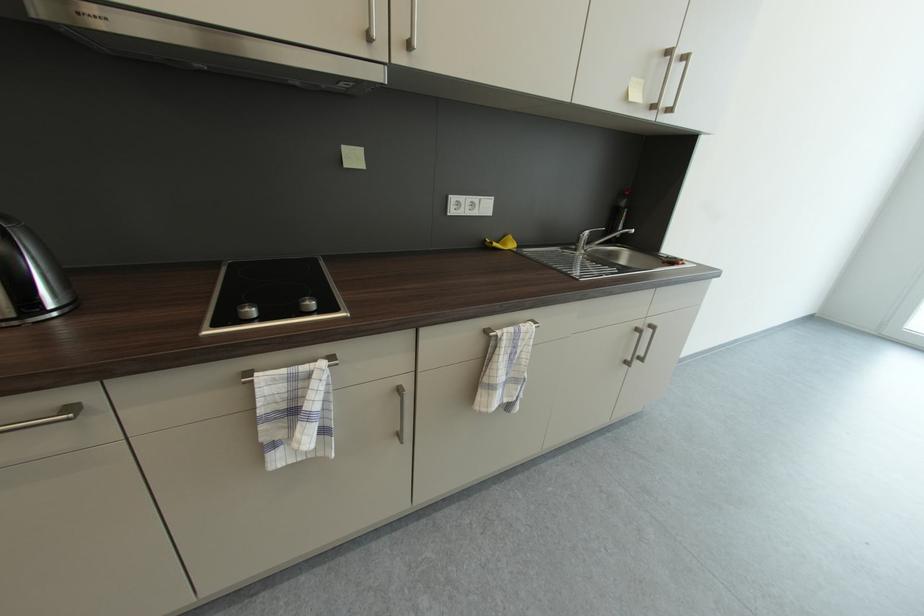
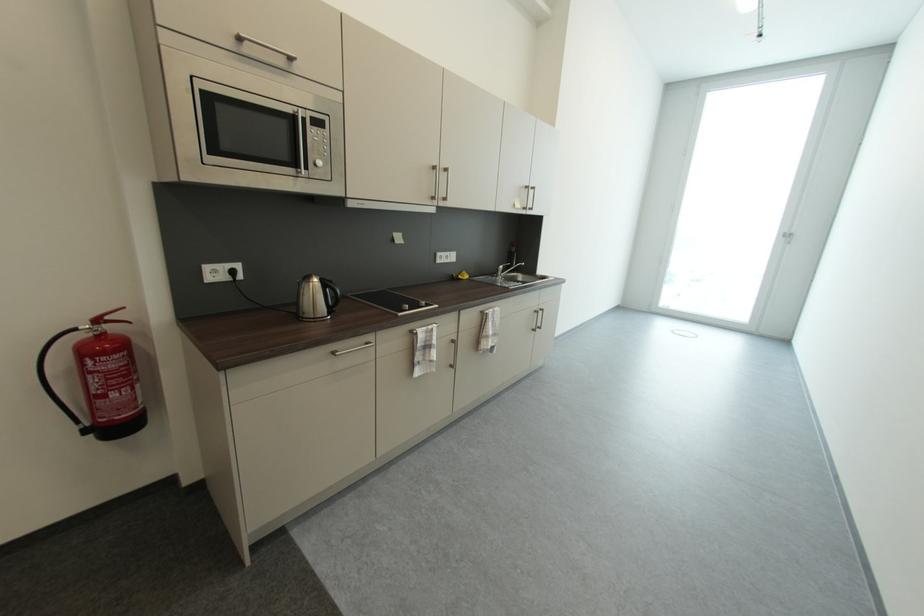
Locate, in the second image, the point that corresponds to (637,100) in the first image.

(523, 209)